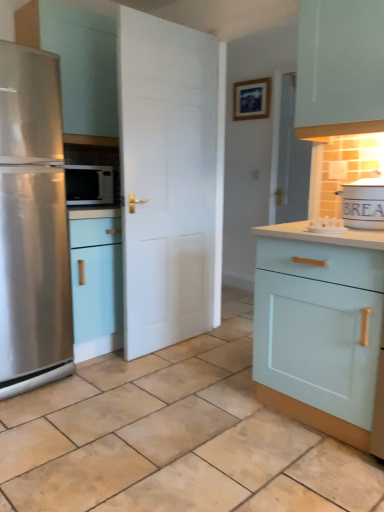
I want to click on free space that is in between white matte door at center and light blue wood cabinet at right, so click(206, 368).